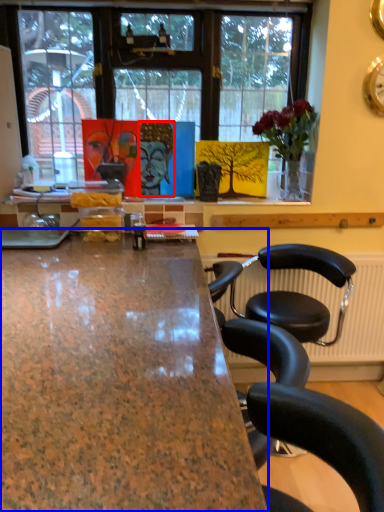
Question: Which object is closer to the camera taking this photo, person (highlighted by a red box) or desk (highlighted by a blue box)?

Choices:
 (A) person
 (B) desk

Answer: (B)